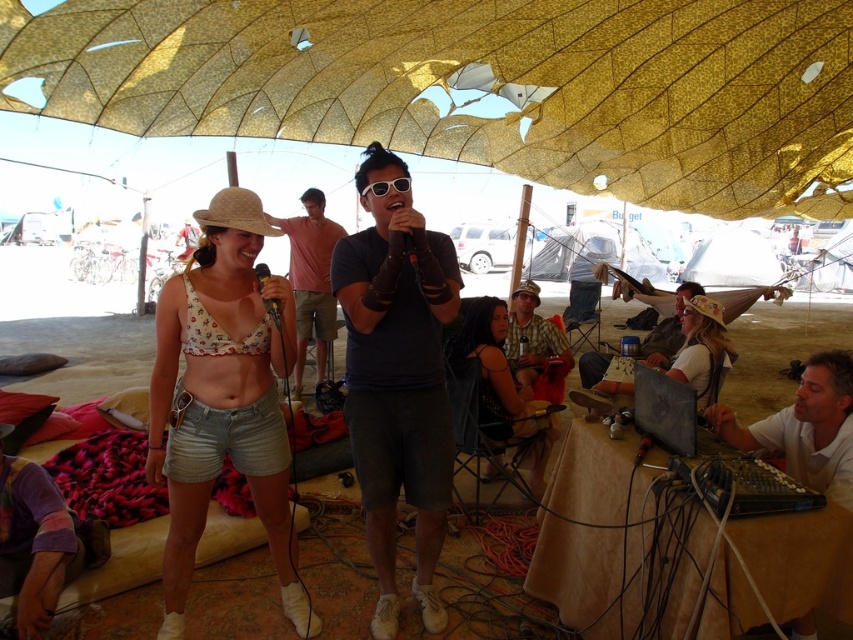
You are planning to set up a small booth between the transparent plastic tent at center and the white fabric tent at center. The booth requires a space of 8 feet. Is there enough space between them to accommodate your booth?

The distance between the transparent plastic tent at center and the white fabric tent at center is 9.09 feet, which is more than the required 8 feet. Therefore, there is enough space to set up the booth between them.

You are standing in the crowd watching the performance. There is a point marked at coordinates (397, 378). Which object is this point located on?

The point at (397, 378) is located on the dark blue t shirt at center.

You are standing at the center of the image and want to find the transparent plastic tent at center. According to the coordinates provided, in which direction should you look to locate it?

The transparent plastic tent at center is located at coordinates point (592,253). Since you are at the center, you should look directly ahead to find it because it is positioned at the center of the image.